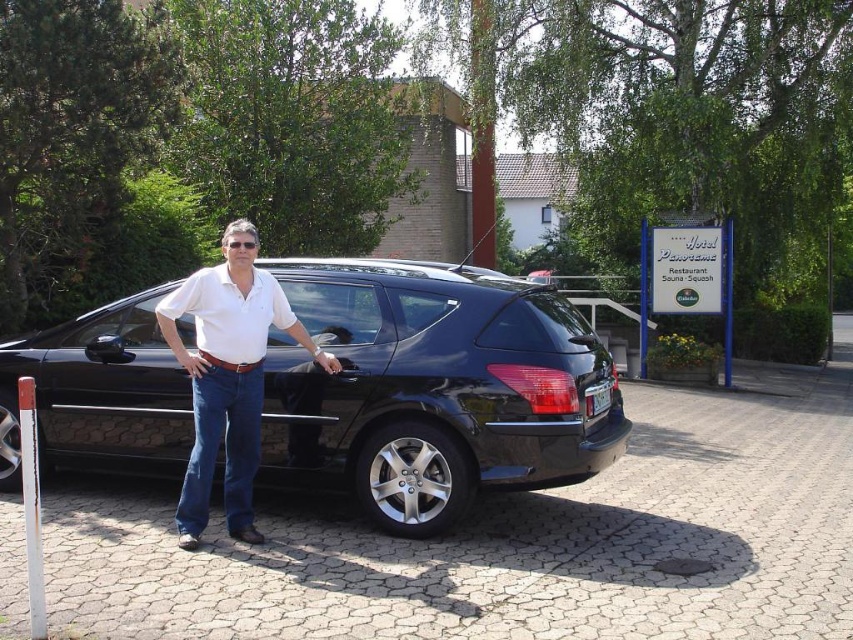
Question: In this image, where is white cotton shirt at center located relative to white plastic license plate at rear?

Choices:
 (A) right
 (B) left

Answer: (B)

Question: Which point is farther to the camera?

Choices:
 (A) glossy black car at center
 (B) white plastic license plate at rear

Answer: (B)

Question: Which point is closer to the camera?

Choices:
 (A) 62,413
 (B) 231,445

Answer: (B)

Question: Does glossy black car at center appear under white cotton shirt at center?

Choices:
 (A) no
 (B) yes

Answer: (A)

Question: Does glossy black car at center have a lesser width compared to white plastic license plate at rear?

Choices:
 (A) yes
 (B) no

Answer: (B)

Question: Which of the following is the farthest from the observer?

Choices:
 (A) glossy black car at center
 (B) white cotton shirt at center
 (C) white plastic license plate at rear

Answer: (C)